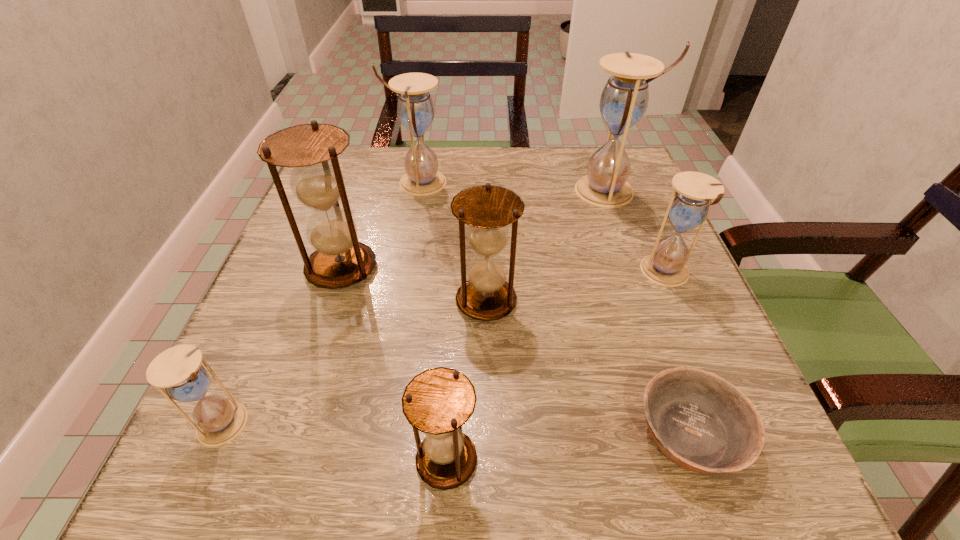
You are a GUI agent. You are given a task and a screenshot of the screen. Output one action in this format:
    pyautogui.click(x=<x>, y=<y>)
    Task: Click on the tallest object
    The image size is (960, 540).
    Given the screenshot: What is the action you would take?
    point(624,100)

The height and width of the screenshot is (540, 960). Find the location of `the biggest white hourglass`. the biggest white hourglass is located at coordinates (624, 100).

Identify the location of the leftmost brown hourglass. (339, 260).

The height and width of the screenshot is (540, 960). Find the location of `the third white hourglass from right to left`. the third white hourglass from right to left is located at coordinates (415, 108).

Locate an element on the screen. The height and width of the screenshot is (540, 960). the second biggest brown hourglass is located at coordinates (487, 209).

What are the coordinates of `the third farthest white hourglass` in the screenshot? It's located at (689, 206).

Identify the location of the leftmost white hourglass. The height and width of the screenshot is (540, 960). (178, 369).

I want to click on the smallest white hourglass, so click(178, 369).

I want to click on the nearest brown hourglass, so click(x=439, y=401).

In order to click on bowl in this screenshot , I will do `click(700, 421)`.